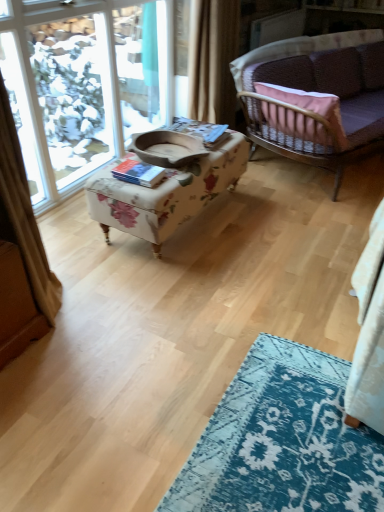
At what (x,y) coordinates should I click in order to perform the action: click on vacant area that is situated to the right of floral fabric ottoman at center. Please return your answer as a coordinate pair (x, y). The height and width of the screenshot is (512, 384). Looking at the image, I should click on pyautogui.click(x=283, y=220).